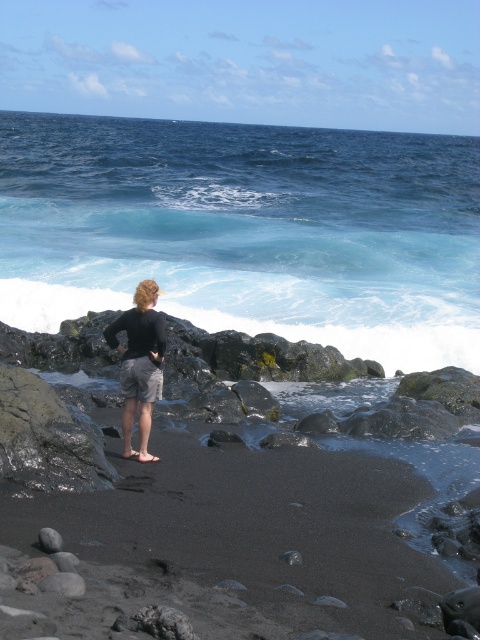
Who is lower down, blue liquid water at center or black matte shorts at center?

black matte shorts at center is lower down.

Is blue liquid water at center to the right of black matte shorts at center from the viewer's perspective?

Correct, you'll find blue liquid water at center to the right of black matte shorts at center.

Where is `blue liquid water at center`? The image size is (480, 640). blue liquid water at center is located at coordinates (247, 230).